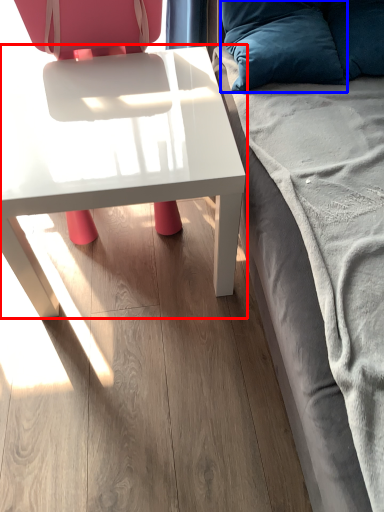
Question: Which of the following is the closest to the observer, table (highlighted by a red box) or pillow (highlighted by a blue box)?

Choices:
 (A) table
 (B) pillow

Answer: (A)